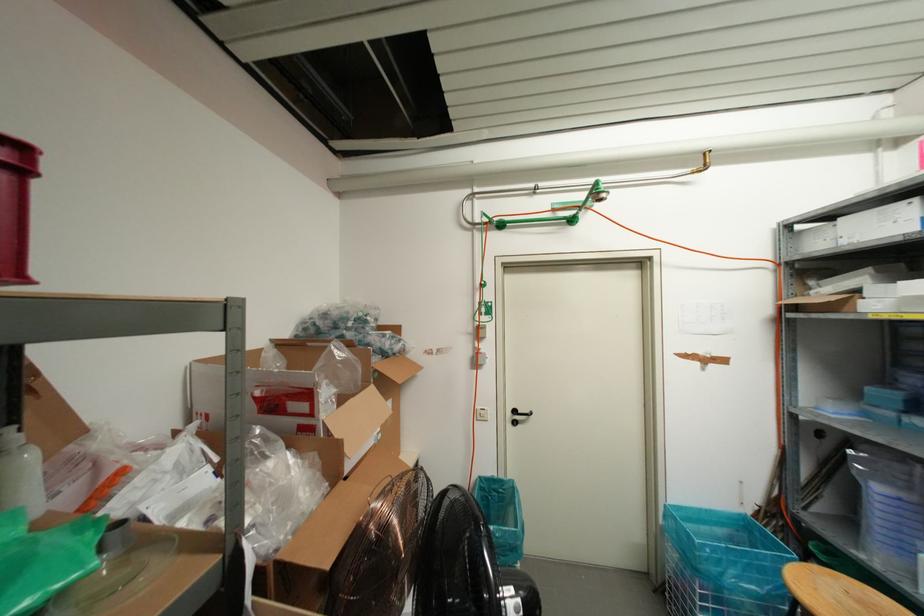
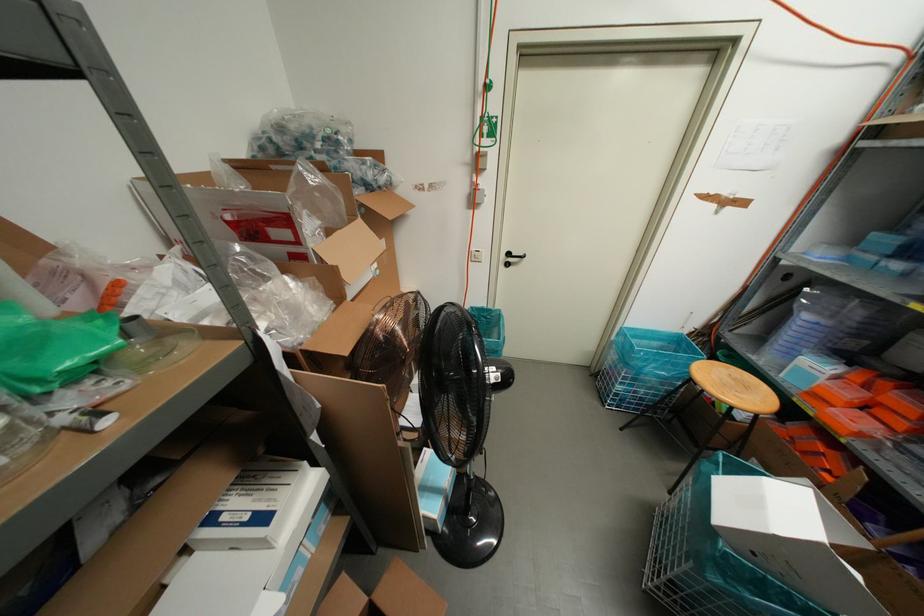
Where in the second image is the point corresponding to point (885, 395) from the first image?

(885, 240)